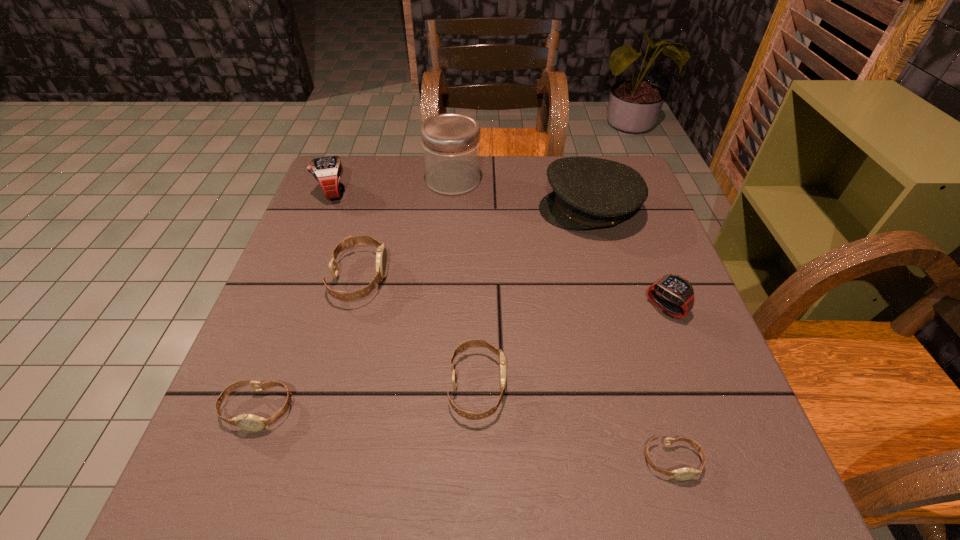
This screenshot has height=540, width=960. What are the coordinates of `free location at the near edge` in the screenshot? It's located at (628, 479).

The image size is (960, 540). In the image, there is a desktop. In order to click on vacant area at the left edge in this screenshot , I will do `click(342, 226)`.

Find the location of a particular element. The image size is (960, 540). vacant space at the right edge of the desktop is located at coordinates (641, 337).

The width and height of the screenshot is (960, 540). What are the coordinates of `vacant area at the far left corner` in the screenshot? It's located at click(x=355, y=180).

Identify the location of vacant space at the far right corner of the desktop. (627, 161).

I want to click on vacant space in between the sixth shortest object and the second shortest watch, so coord(296,301).

The image size is (960, 540). What are the coordinates of `free space between the right red watch and the farthest watch` in the screenshot? It's located at (499, 251).

At what (x,y) coordinates should I click in order to perform the action: click on vacant area that lies between the right red watch and the second shortest watch. Please return your answer as a coordinate pair (x, y). The image size is (960, 540). Looking at the image, I should click on click(462, 359).

Locate an element on the screen. The image size is (960, 540). vacant region between the third smallest beige watch and the farther red watch is located at coordinates (405, 289).

Locate an element on the screen. This screenshot has width=960, height=540. vacant space that's between the second shortest watch and the beret is located at coordinates (423, 309).